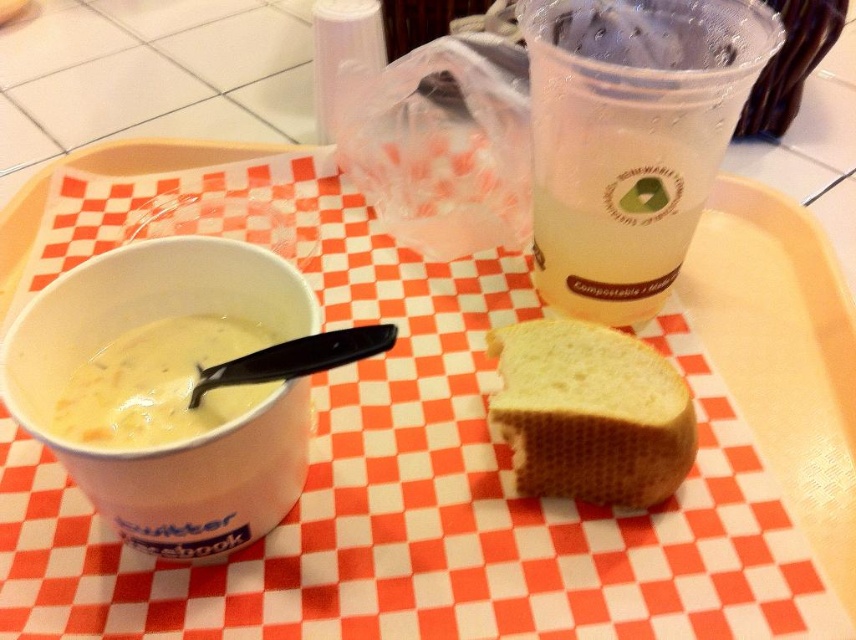
Is clear plastic cup at upper right in front of white creamy soup at left?

Yes, it is.

Can you confirm if clear plastic cup at upper right is wider than white creamy soup at left?

Yes.

Is point (583, 200) less distant than point (82, 442)?

No, it is behind (82, 442).

The height and width of the screenshot is (640, 856). I want to click on clear plastic cup at upper right, so click(629, 138).

Based on the photo, how far apart are clear plastic cup at upper right and golden brown crusty bread at center?

clear plastic cup at upper right is 6.61 inches from golden brown crusty bread at center.

Between clear plastic cup at upper right and golden brown crusty bread at center, which one appears on the right side from the viewer's perspective?

clear plastic cup at upper right

Does point (616, 186) come behind point (528, 355)?

That is True.

Identify the location of clear plastic cup at upper right. The width and height of the screenshot is (856, 640). (629, 138).

Between golden brown crusty bread at center and white creamy soup at left, which one has less height?

Standing shorter between the two is white creamy soup at left.

Who is more forward, (x=539, y=390) or (x=171, y=344)?

Point (x=539, y=390)

Identify the location of golden brown crusty bread at center. (x=590, y=413).